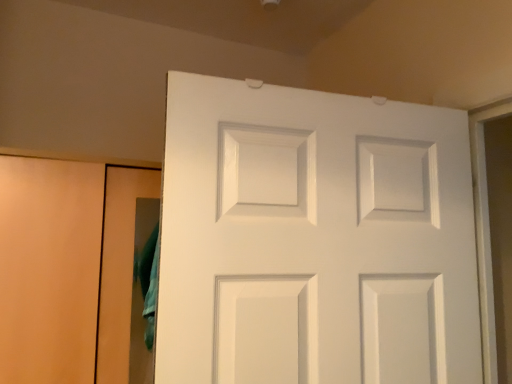
What do you see at coordinates (314, 239) in the screenshot? I see `white glossy door at center` at bounding box center [314, 239].

Image resolution: width=512 pixels, height=384 pixels. I want to click on white glossy door at center, so click(x=314, y=239).

In order to face white glossy door at center, should I rotate leftwards or rightwards?

Turn right by 11.486 degrees to look at white glossy door at center.

Find the location of a particular element. This screenshot has height=384, width=512. white glossy door at center is located at coordinates (314, 239).